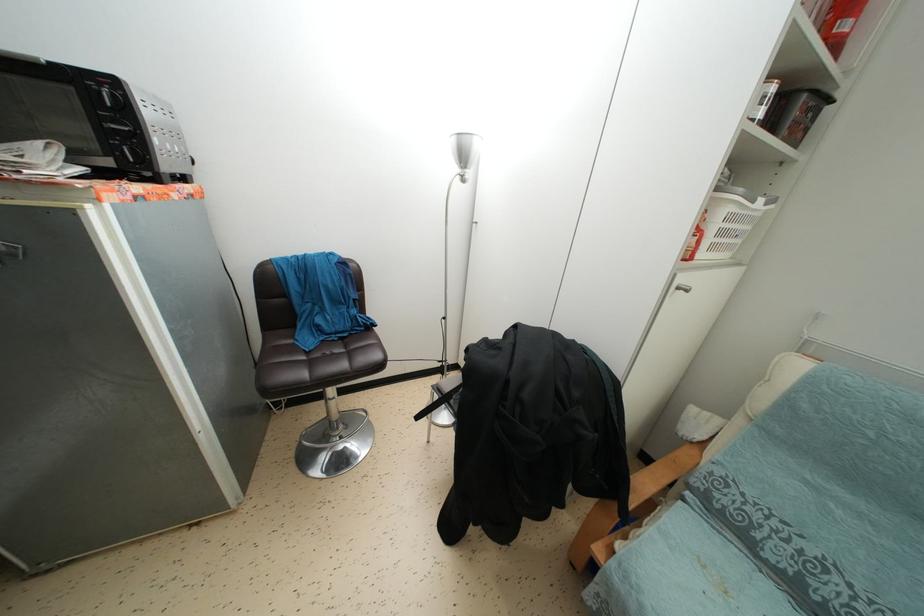
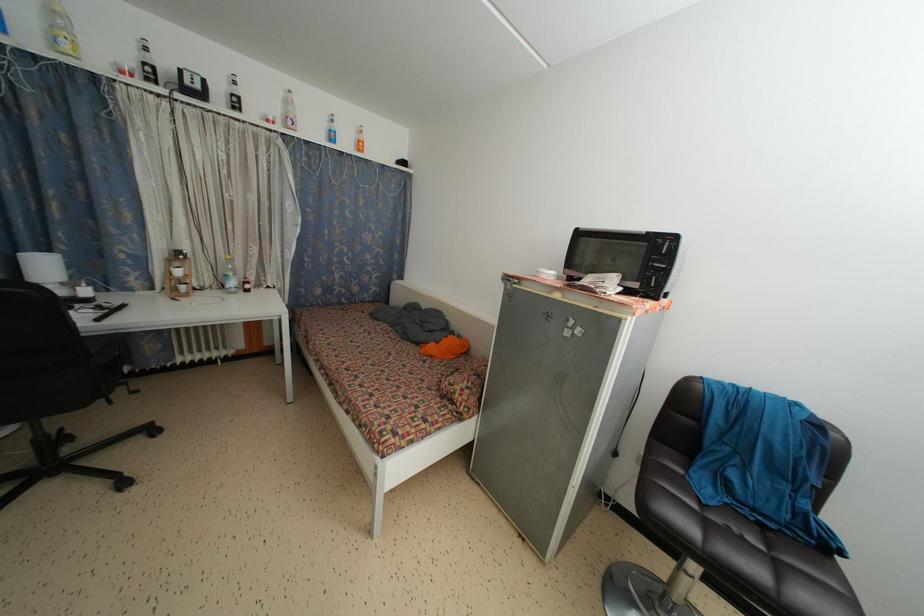
Question: The camera is either moving clockwise (left) or counter-clockwise (right) around the object. The first image is from the beginning of the video and the second image is from the end. Is the camera moving left or right when shooting the video?

Choices:
 (A) Left
 (B) Right

Answer: (B)